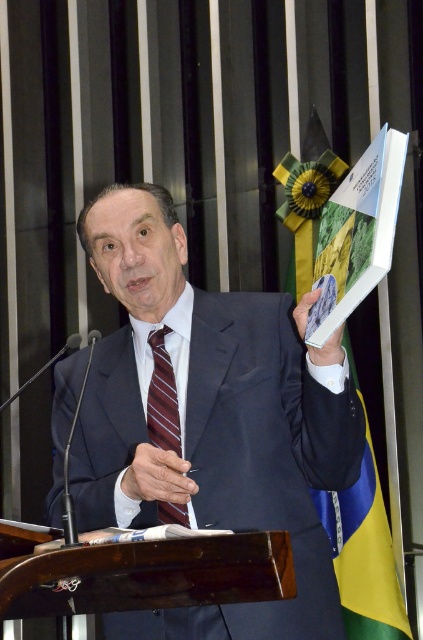
Question: Does yellow-green fabric flag at upper right lie behind maroon striped tie at center?

Choices:
 (A) yes
 (B) no

Answer: (A)

Question: Which object appears closest to the camera in this image?

Choices:
 (A) yellow-green fabric flag at upper right
 (B) gray suit at center

Answer: (B)

Question: Does gray suit at center come behind maroon striped tie at center?

Choices:
 (A) no
 (B) yes

Answer: (A)

Question: Which object is farther from the camera taking this photo?

Choices:
 (A) gray suit at center
 (B) maroon striped tie at center

Answer: (B)

Question: Which of the following is the farthest from the observer?

Choices:
 (A) gray suit at center
 (B) yellow-green fabric flag at upper right
 (C) maroon striped tie at center

Answer: (B)

Question: Is yellow-green fabric flag at upper right below maroon striped tie at center?

Choices:
 (A) yes
 (B) no

Answer: (B)